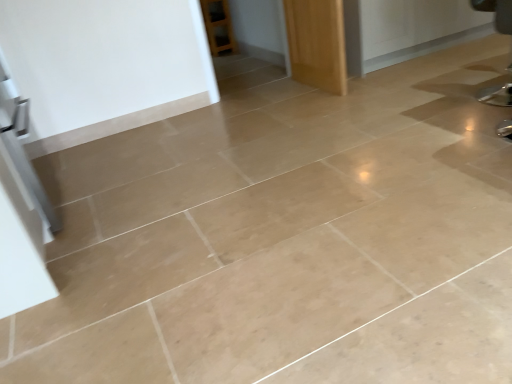
Question: Is point coord(302,31) positioned closer to the camera than point coord(508,94)?

Choices:
 (A) closer
 (B) farther

Answer: (B)

Question: Considering the positions of wooden door at upper center and metallic silver swivel chair at right in the image, is wooden door at upper center wider or thinner than metallic silver swivel chair at right?

Choices:
 (A) thin
 (B) wide

Answer: (A)

Question: From a real-world perspective, is wooden door at upper center positioned above or below metallic silver swivel chair at right?

Choices:
 (A) below
 (B) above

Answer: (A)

Question: In terms of size, does metallic silver swivel chair at right appear bigger or smaller than wooden door at upper center?

Choices:
 (A) small
 (B) big

Answer: (A)

Question: From the image's perspective, is metallic silver swivel chair at right located above or below wooden door at upper center?

Choices:
 (A) below
 (B) above

Answer: (A)

Question: From a real-world perspective, is metallic silver swivel chair at right above or below wooden door at upper center?

Choices:
 (A) below
 (B) above

Answer: (B)

Question: Is metallic silver swivel chair at right to the left or to the right of wooden door at upper center in the image?

Choices:
 (A) right
 (B) left

Answer: (A)